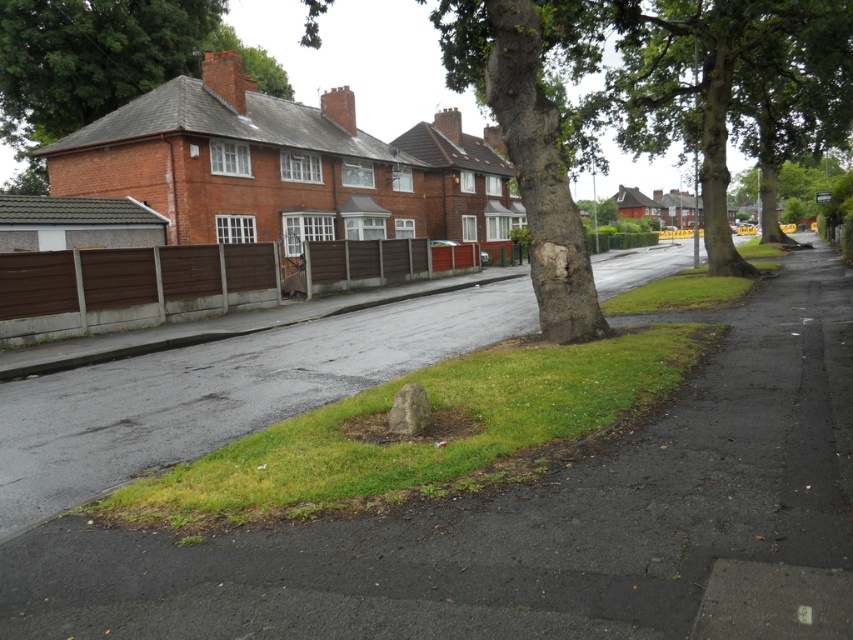
Is point (10, 56) positioned after point (825, 209)?

That is False.

Which is more to the right, green leafy tree at upper center or green leafy tree at upper right?

green leafy tree at upper right is more to the right.

Image resolution: width=853 pixels, height=640 pixels. I want to click on green leafy tree at upper center, so click(103, 58).

Who is more forward, (821,83) or (96,42)?

Positioned in front is point (821,83).

Who is positioned more to the right, green leafy tree at center or green leafy tree at upper center?

Positioned to the right is green leafy tree at center.

Find the location of a particular element. The height and width of the screenshot is (640, 853). green leafy tree at center is located at coordinates (732, 90).

At what (x,y) coordinates should I click in order to perform the action: click on green leafy tree at center. Please return your answer as a coordinate pair (x, y). The image size is (853, 640). Looking at the image, I should click on (732, 90).

This screenshot has height=640, width=853. Describe the element at coordinates (732, 90) in the screenshot. I see `green leafy tree at center` at that location.

Is point (808, 58) positioned in front of point (839, 196)?

Yes, point (808, 58) is in front of point (839, 196).

This screenshot has height=640, width=853. What do you see at coordinates (732, 90) in the screenshot?
I see `green leafy tree at center` at bounding box center [732, 90].

Where is `green leafy tree at center`? Image resolution: width=853 pixels, height=640 pixels. green leafy tree at center is located at coordinates (732, 90).